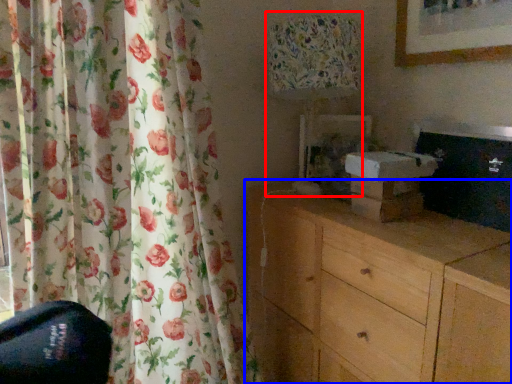
Question: Which of the following is the closest to the observer, table lamp (highlighted by a red box) or chest of drawers (highlighted by a blue box)?

Choices:
 (A) table lamp
 (B) chest of drawers

Answer: (B)